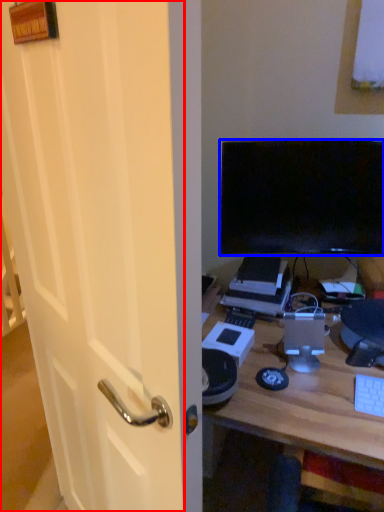
Question: Which object is closer to the camera taking this photo, glass door (highlighted by a red box) or television (highlighted by a blue box)?

Choices:
 (A) glass door
 (B) television

Answer: (A)